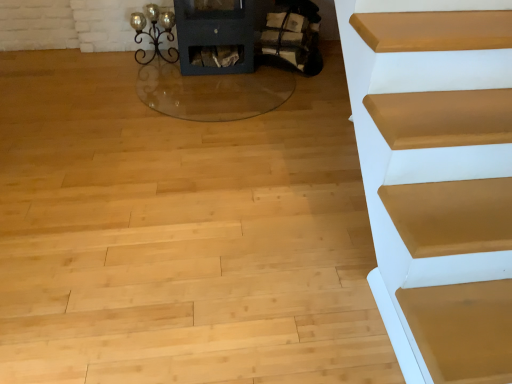
I want to click on wooden logs at center, so click(292, 37).

Describe the element at coordinates (292, 37) in the screenshot. I see `wooden logs at center` at that location.

What do you see at coordinates (154, 32) in the screenshot?
I see `metallic wrought iron candle holder at upper left` at bounding box center [154, 32].

Find the location of a particular element. Image resolution: width=512 pixels, height=384 pixels. metallic wrought iron candle holder at upper left is located at coordinates click(154, 32).

The height and width of the screenshot is (384, 512). I want to click on wooden logs at center, so click(x=292, y=37).

In the image, is metallic wrought iron candle holder at upper left on the left side or the right side of wooden logs at center?

In the image, metallic wrought iron candle holder at upper left appears on the left side of wooden logs at center.

Which object is more forward, metallic wrought iron candle holder at upper left or wooden logs at center?

wooden logs at center is closer to the camera.

Is point (173, 18) positioned after point (313, 6)?

That is True.

From the image's perspective, which object appears higher, metallic wrought iron candle holder at upper left or wooden logs at center?

wooden logs at center appears higher in the image.

From a real-world perspective, is metallic wrought iron candle holder at upper left above or below wooden logs at center?

metallic wrought iron candle holder at upper left is situated lower than wooden logs at center in the real world.

Considering the relative sizes of metallic wrought iron candle holder at upper left and wooden logs at center in the image provided, is metallic wrought iron candle holder at upper left thinner than wooden logs at center?

Yes.

Can you confirm if metallic wrought iron candle holder at upper left is shorter than wooden logs at center?

→ Yes, metallic wrought iron candle holder at upper left is shorter than wooden logs at center.

Consider the image. Can you confirm if metallic wrought iron candle holder at upper left is smaller than wooden logs at center?

Indeed, metallic wrought iron candle holder at upper left has a smaller size compared to wooden logs at center.

Is wooden logs at center surrounded by metallic wrought iron candle holder at upper left?

No, wooden logs at center is not inside metallic wrought iron candle holder at upper left.

Consider the image. Would you say metallic wrought iron candle holder at upper left is a long distance from wooden logs at center?

No.

Is metallic wrought iron candle holder at upper left positioned with its back to wooden logs at center?

No, wooden logs at center is not at the back of metallic wrought iron candle holder at upper left.

Where is `light behind the wooden logs at center`? The image size is (512, 384). light behind the wooden logs at center is located at coordinates (154, 32).

Can you confirm if wooden logs at center is positioned to the left of metallic wrought iron candle holder at upper left?

No, wooden logs at center is not to the left of metallic wrought iron candle holder at upper left.

Which is in front, wooden logs at center or metallic wrought iron candle holder at upper left?

wooden logs at center is more forward.

Between point (300, 32) and point (166, 11), which one is positioned behind?

Positioned behind is point (166, 11).

From the image's perspective, who appears lower, wooden logs at center or metallic wrought iron candle holder at upper left?

metallic wrought iron candle holder at upper left, from the image's perspective.

From a real-world perspective, is wooden logs at center positioned over metallic wrought iron candle holder at upper left based on gravity?

Yes.

Between wooden logs at center and metallic wrought iron candle holder at upper left, which one has smaller width?

metallic wrought iron candle holder at upper left is thinner.

Considering the sizes of wooden logs at center and metallic wrought iron candle holder at upper left in the image, is wooden logs at center taller or shorter than metallic wrought iron candle holder at upper left?

Clearly, wooden logs at center is taller compared to metallic wrought iron candle holder at upper left.

Which of these two, wooden logs at center or metallic wrought iron candle holder at upper left, is smaller?

With smaller size is metallic wrought iron candle holder at upper left.

Is wooden logs at center situated inside metallic wrought iron candle holder at upper left or outside?

wooden logs at center is outside metallic wrought iron candle holder at upper left.

Is wooden logs at center not near metallic wrought iron candle holder at upper left?

No, wooden logs at center is not far away from metallic wrought iron candle holder at upper left.

Is wooden logs at center oriented away from metallic wrought iron candle holder at upper left?

No, metallic wrought iron candle holder at upper left is not at the back of wooden logs at center.

What's the angular difference between wooden logs at center and metallic wrought iron candle holder at upper left's facing directions?

The facing directions of wooden logs at center and metallic wrought iron candle holder at upper left are 0.000481 degrees apart.

Locate an element on the screen. chair located on the right of metallic wrought iron candle holder at upper left is located at coordinates (292, 37).

This screenshot has height=384, width=512. What are the coordinates of `chair that appears above the metallic wrought iron candle holder at upper left (from the image's perspective)` in the screenshot? It's located at (292, 37).

Locate an element on the screen. The height and width of the screenshot is (384, 512). light below the wooden logs at center (from the image's perspective) is located at coordinates (154, 32).